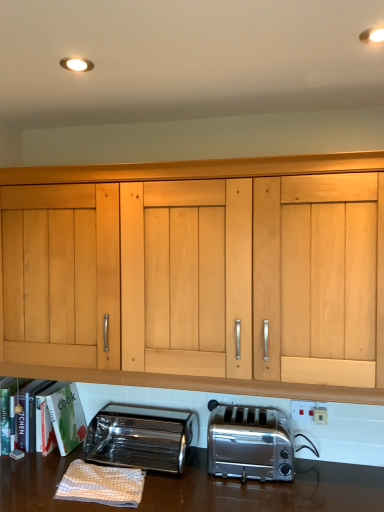
Question: In which direction should I rotate to look at satin silver toaster at lower center, the 2th toaster from the left?

Choices:
 (A) left
 (B) right

Answer: (B)

Question: Considering the relative sizes of white plastic electrical outlet at lower center, which is the second electric outlet in left-to-right order, and polished stainless steel toaster at lower left, which is the 2th toaster from right to left, in the image provided, is white plastic electrical outlet at lower center, which is the second electric outlet in left-to-right order, wider than polished stainless steel toaster at lower left, which is the 2th toaster from right to left,?

Choices:
 (A) yes
 (B) no

Answer: (B)

Question: Is white plastic electrical outlet at lower center, positioned as the second electric outlet in back-to-front order, placed right next to polished stainless steel toaster at lower left, arranged as the first toaster when viewed from the left?

Choices:
 (A) no
 (B) yes

Answer: (A)

Question: Is polished stainless steel toaster at lower left, which is the 2th toaster from right to left, completely or partially inside white plastic electrical outlet at lower center, which is the second electric outlet in left-to-right order?

Choices:
 (A) no
 (B) yes

Answer: (A)

Question: Is white plastic electrical outlet at lower center, which is the second electric outlet in left-to-right order, completely or partially outside of polished stainless steel toaster at lower left, arranged as the first toaster when viewed from the left?

Choices:
 (A) no
 (B) yes

Answer: (B)

Question: Can you confirm if white plastic electrical outlet at lower center, which is the second electric outlet in left-to-right order, is taller than polished stainless steel toaster at lower left, arranged as the first toaster when viewed from the left?

Choices:
 (A) yes
 (B) no

Answer: (B)

Question: Can you confirm if white plastic electrical outlet at lower center, which is the second electric outlet in left-to-right order, is positioned to the right of polished stainless steel toaster at lower left, arranged as the first toaster when viewed from the left?

Choices:
 (A) yes
 (B) no

Answer: (A)

Question: Is the surface of hardcover books at lower left in direct contact with white plastic electrical outlet at lower center, which appears as the 1th electric outlet when viewed from the right?

Choices:
 (A) no
 (B) yes

Answer: (A)

Question: From the image's perspective, does hardcover books at lower left appear lower than white plastic electrical outlet at lower center, positioned as the second electric outlet in back-to-front order?

Choices:
 (A) yes
 (B) no

Answer: (A)

Question: From a real-world perspective, is hardcover books at lower left below white plastic electrical outlet at lower center, positioned as the second electric outlet in back-to-front order?

Choices:
 (A) yes
 (B) no

Answer: (A)

Question: Is hardcover books at lower left smaller than white plastic electrical outlet at lower center, which is the second electric outlet in left-to-right order?

Choices:
 (A) no
 (B) yes

Answer: (A)

Question: Is hardcover books at lower left not inside white plastic electrical outlet at lower center, which appears as the 1th electric outlet when viewed from the right?

Choices:
 (A) no
 (B) yes

Answer: (B)

Question: Can you confirm if hardcover books at lower left is thinner than white plastic electrical outlet at lower center, which is the second electric outlet in left-to-right order?

Choices:
 (A) no
 (B) yes

Answer: (A)

Question: Considering the relative sizes of polished stainless steel toaster at lower left, arranged as the first toaster when viewed from the left, and satin silver toaster at lower center, positioned as the first toaster in right-to-left order, in the image provided, is polished stainless steel toaster at lower left, arranged as the first toaster when viewed from the left, bigger than satin silver toaster at lower center, positioned as the first toaster in right-to-left order,?

Choices:
 (A) yes
 (B) no

Answer: (B)